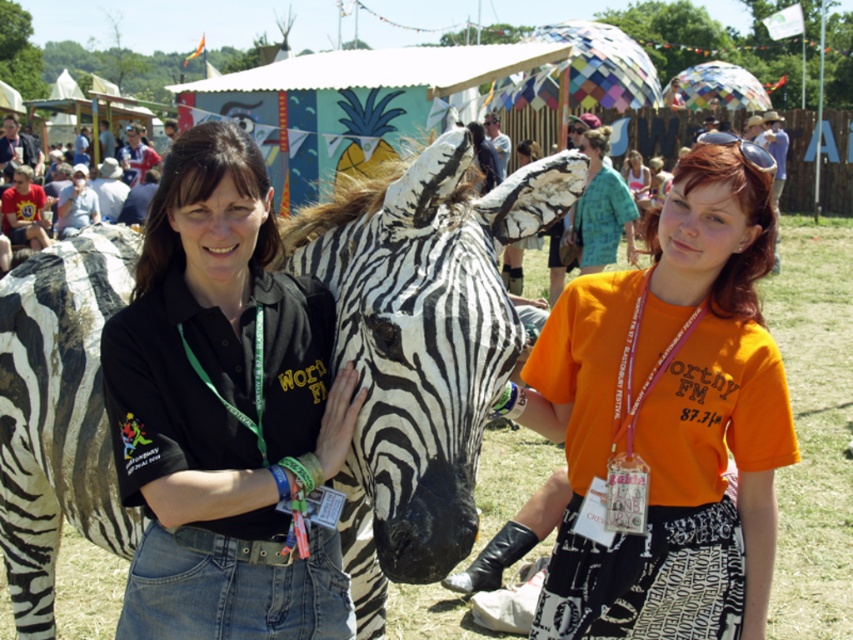
You are taking a photo of the festival scene. You want to focus on the point closer to the camera between the two points labeled as point (x=170, y=316) and point (x=788, y=435). Which point should you focus on?

You should focus on point (x=170, y=316) because it is closer to the camera than point (x=788, y=435).

You are a photographer standing at the event and want to take a closeup shot of the black matte shirt at center. Your camera has a minimum focusing distance of 2 meters. Can you get the shot without moving closer?

The black matte shirt at center is 2.32 meters away from the camera. Since the minimum focusing distance is 2 meters, the camera can focus on the black matte shirt at center as it is within range.